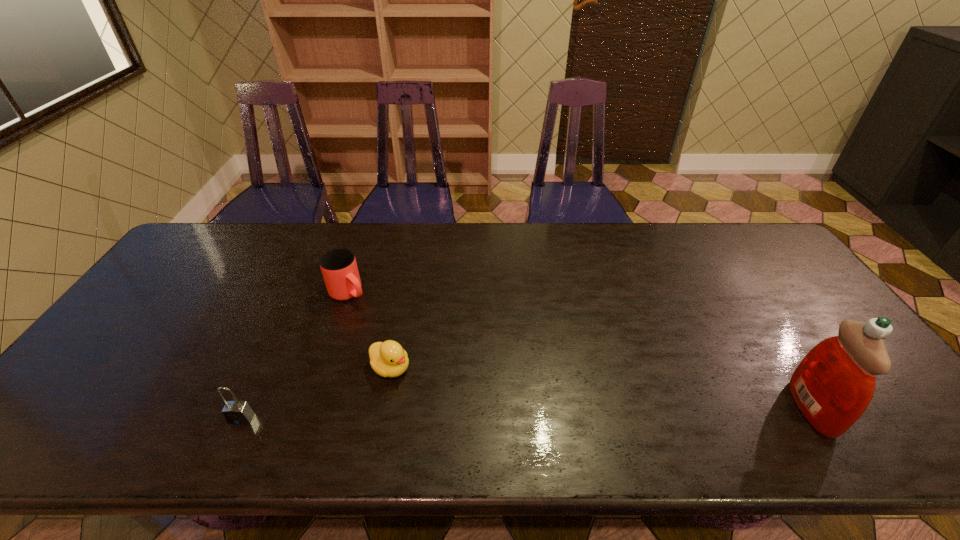
The width and height of the screenshot is (960, 540). What are the coordinates of `padlock` in the screenshot? It's located at (236, 412).

Identify the location of the tallest object. Image resolution: width=960 pixels, height=540 pixels. (833, 385).

This screenshot has width=960, height=540. I want to click on detergent, so click(x=833, y=385).

In order to click on the second object from left to right in this screenshot , I will do `click(339, 268)`.

You are a GUI agent. You are given a task and a screenshot of the screen. Output one action in this format:
    pyautogui.click(x=<x>, y=<y>)
    Task: Click on the cup
    Image resolution: width=960 pixels, height=540 pixels.
    Given the screenshot: What is the action you would take?
    pyautogui.click(x=339, y=268)

This screenshot has height=540, width=960. In order to click on the shortest object in this screenshot , I will do `click(388, 359)`.

You are a GUI agent. You are given a task and a screenshot of the screen. Output one action in this format:
    pyautogui.click(x=<x>, y=<y>)
    Task: Click on the third object from left to right
    The width and height of the screenshot is (960, 540).
    Given the screenshot: What is the action you would take?
    pyautogui.click(x=388, y=359)

Identify the location of free space located 0.070m on the front surface of the rightmost object. This screenshot has width=960, height=540. (858, 408).

The image size is (960, 540). What are the coordinates of `free space located 0.080m on the handle side of the cup` in the screenshot? It's located at (376, 316).

Locate an element on the screen. vacant space located on the handle side of the cup is located at coordinates (413, 347).